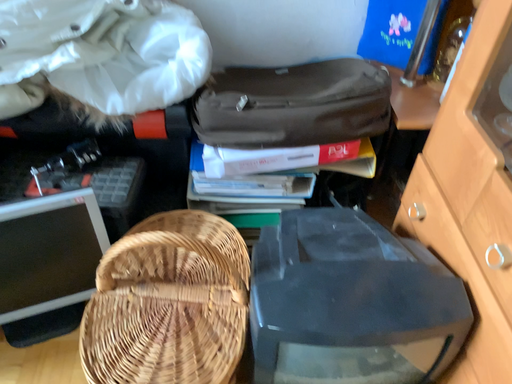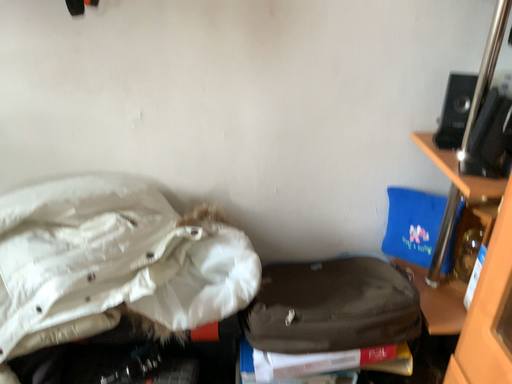
Question: Which way did the camera rotate in the video?

Choices:
 (A) rotated upward
 (B) rotated downward

Answer: (A)